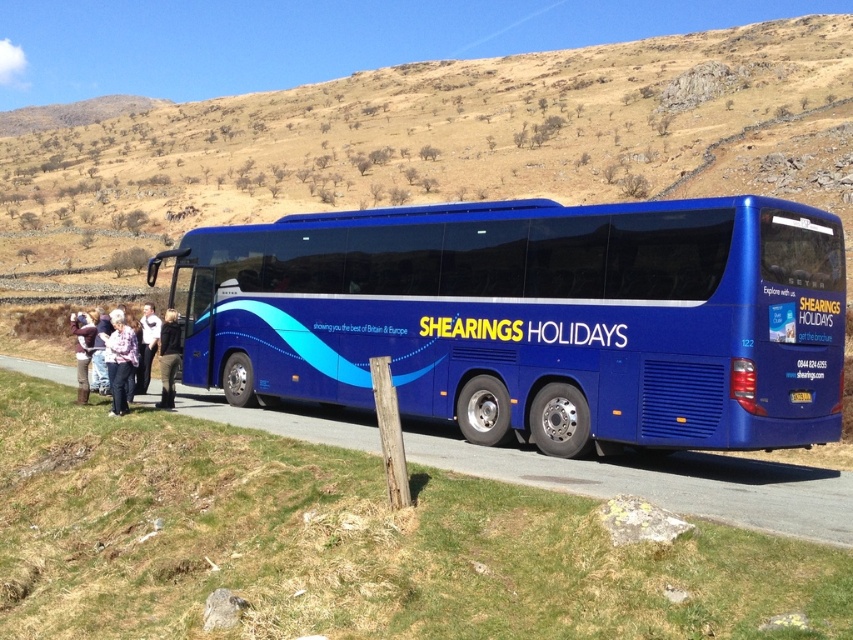
Who is higher up, floral shirt at left or light pink fabric pants at lower left?

Positioned higher is light pink fabric pants at lower left.

Is point (111, 403) more distant than point (142, 312)?

No.

Locate an element on the screen. The height and width of the screenshot is (640, 853). floral shirt at left is located at coordinates (120, 360).

How much distance is there between blue metallic bus at center and plaid shirt at center?

blue metallic bus at center is 5.58 meters from plaid shirt at center.

Is blue metallic bus at center taller than plaid shirt at center?

Yes.

Does point (223, 236) come behind point (123, 317)?

Yes, it is.

This screenshot has height=640, width=853. In order to click on blue metallic bus at center in this screenshot , I will do `click(534, 317)`.

Can you confirm if weathered wood post at lower center is positioned to the left of plaid shirt at center?

No, weathered wood post at lower center is not to the left of plaid shirt at center.

Who is positioned more to the left, weathered wood post at lower center or plaid shirt at center?

Positioned to the left is plaid shirt at center.

Which is behind, point (390, 465) or point (122, 346)?

Positioned behind is point (122, 346).

I want to click on weathered wood post at lower center, so click(x=389, y=432).